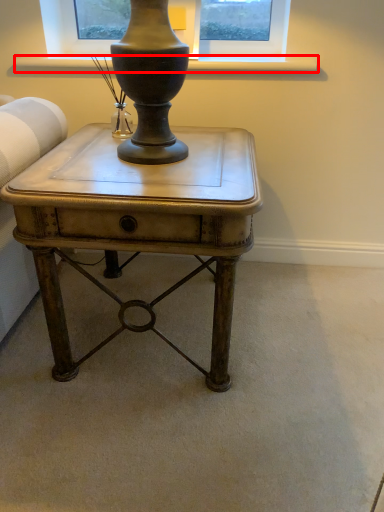
Question: From the image, what is the correct spatial relationship of window sill (annotated by the red box) in relation to table?

Choices:
 (A) right
 (B) left

Answer: (A)